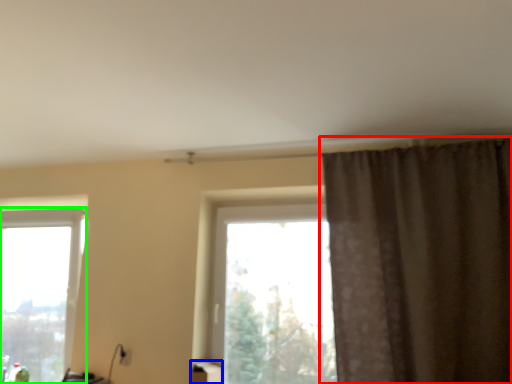
Question: Considering the real-world distances, which object is closest to curtain (highlighted by a red box)? furniture (highlighted by a blue box) or window (highlighted by a green box).

Choices:
 (A) furniture
 (B) window

Answer: (A)